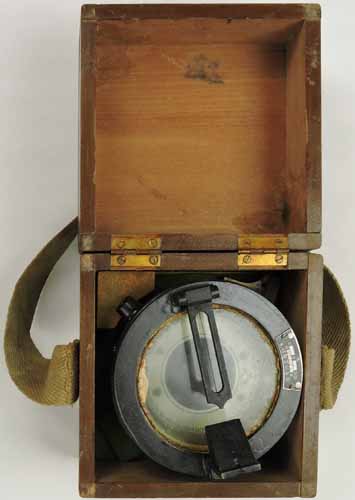
Where is `cover of box`? The width and height of the screenshot is (355, 500). cover of box is located at coordinates (201, 113).